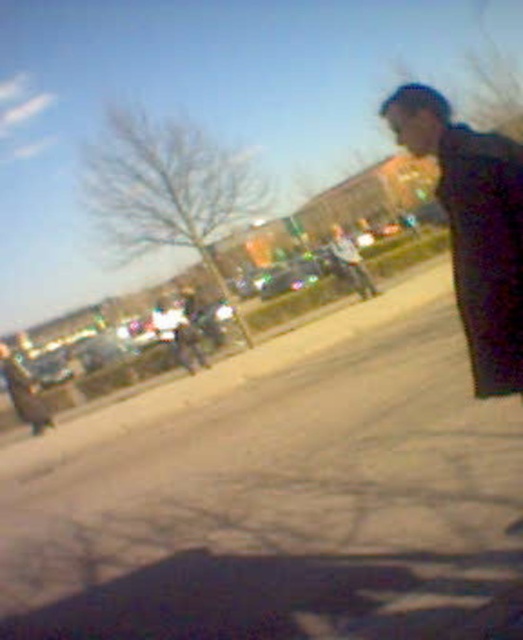
Question: Is gray asphalt pavement at center wider than dark gray jacket at right?

Choices:
 (A) yes
 (B) no

Answer: (A)

Question: Can you confirm if gray asphalt pavement at center is smaller than dark gray jacket at right?

Choices:
 (A) yes
 (B) no

Answer: (B)

Question: Which of the following is the closest to the observer?

Choices:
 (A) (485, 552)
 (B) (487, 394)

Answer: (B)

Question: Among these points, which one is farthest from the camera?

Choices:
 (A) (517, 284)
 (B) (219, 449)

Answer: (B)

Question: Which of the following is the closest to the observer?

Choices:
 (A) gray asphalt pavement at center
 (B) dark gray jacket at right

Answer: (B)

Question: Is gray asphalt pavement at center behind dark gray jacket at right?

Choices:
 (A) no
 (B) yes

Answer: (B)